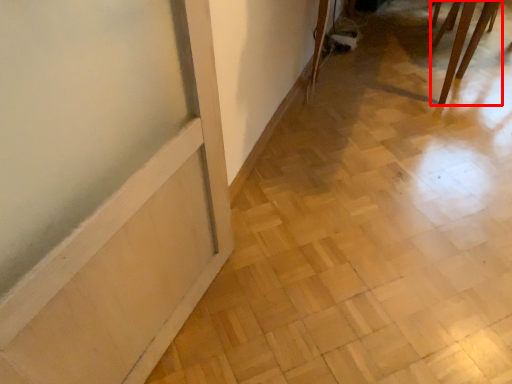
Question: From the image's perspective, what is the correct spatial relationship of furniture (annotated by the red box) in relation to tile?

Choices:
 (A) below
 (B) above

Answer: (B)